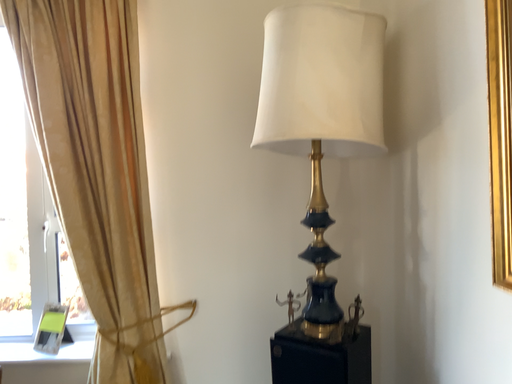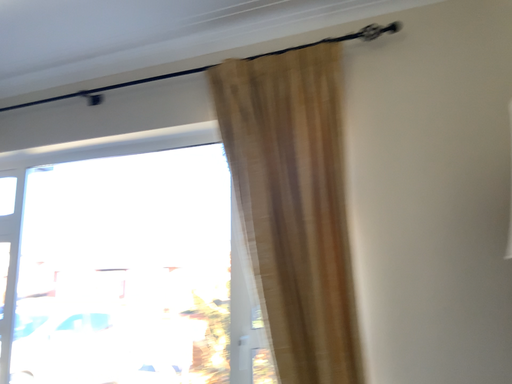
Question: How did the camera likely rotate when shooting the video?

Choices:
 (A) rotated right
 (B) rotated left

Answer: (B)